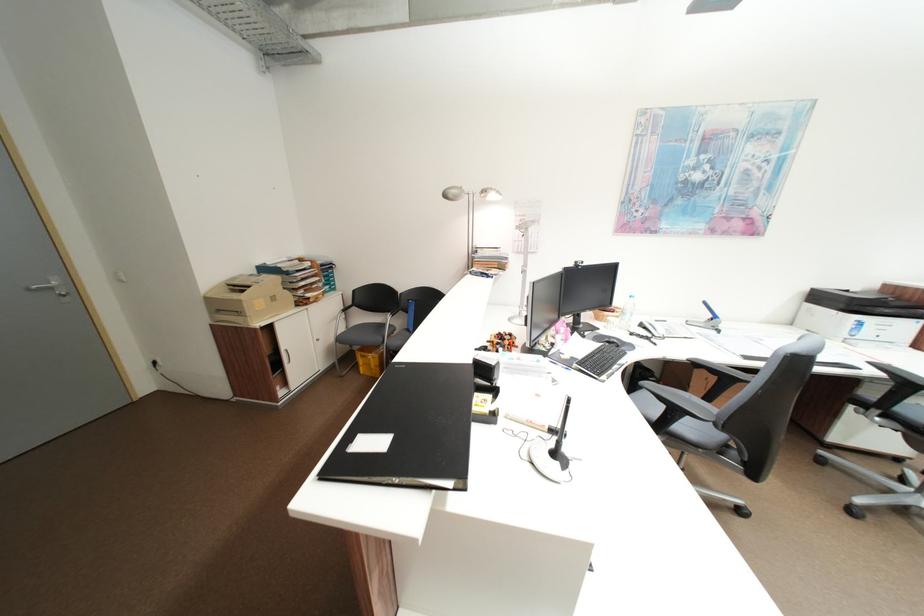
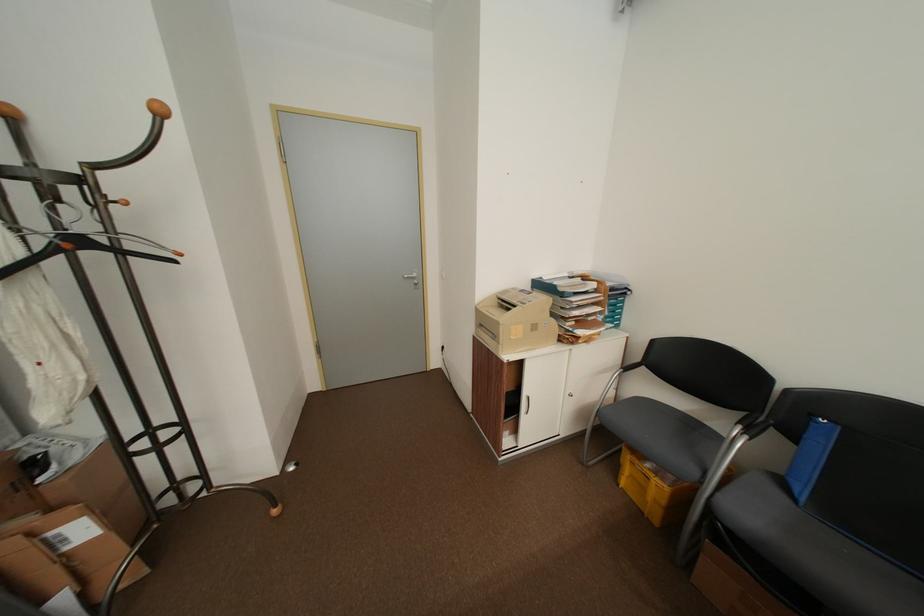
In the second image, find the point that corresponds to (385,357) in the first image.

(676, 488)